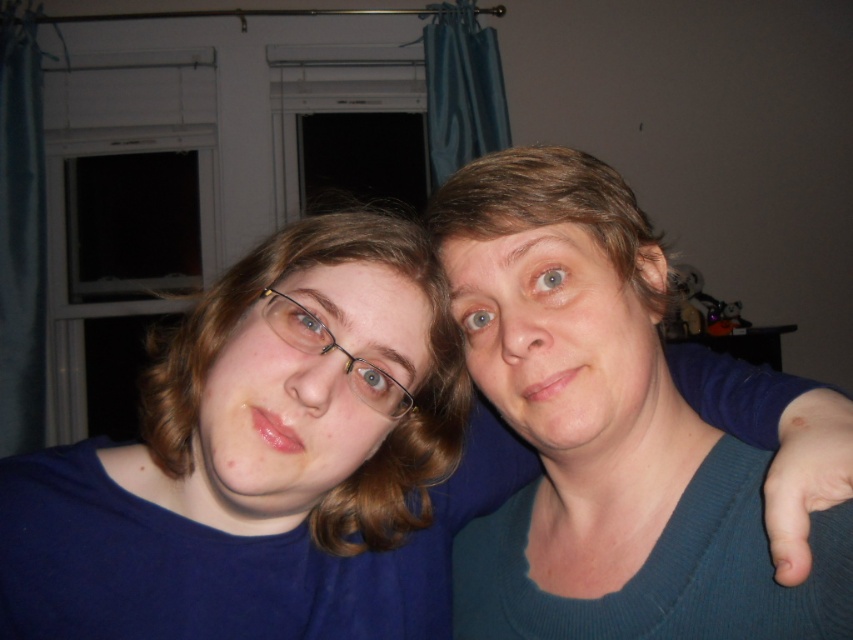
Between teal sweater at center and clear plastic glasses at center, which one appears on the right side from the viewer's perspective?

teal sweater at center

Can you confirm if teal sweater at center is thinner than clear plastic glasses at center?

Incorrect, teal sweater at center's width is not less than clear plastic glasses at center's.

Between point (608, 518) and point (349, 381), which one is positioned behind?

The point (608, 518) is behind.

Find the location of `teal sweater at center`. teal sweater at center is located at coordinates (604, 429).

Between point (78, 582) and point (355, 387), which one is positioned behind?

Positioned behind is point (78, 582).

Measure the distance between point [253,589] and camera.

They are 23.79 inches apart.

Between point (384, 250) and point (323, 340), which one is positioned behind?

Point (384, 250)

The height and width of the screenshot is (640, 853). In order to click on matte blue sweater at center in this screenshot , I will do `click(271, 461)`.

Is matte blue sweater at center thinner than teal sweater at center?

No, matte blue sweater at center is not thinner than teal sweater at center.

You are a GUI agent. You are given a task and a screenshot of the screen. Output one action in this format:
    pyautogui.click(x=<x>, y=<y>)
    Task: Click on the matte blue sweater at center
    The width and height of the screenshot is (853, 640).
    Given the screenshot: What is the action you would take?
    pyautogui.click(x=271, y=461)

Locate an element on the screen. This screenshot has width=853, height=640. matte blue sweater at center is located at coordinates (271, 461).